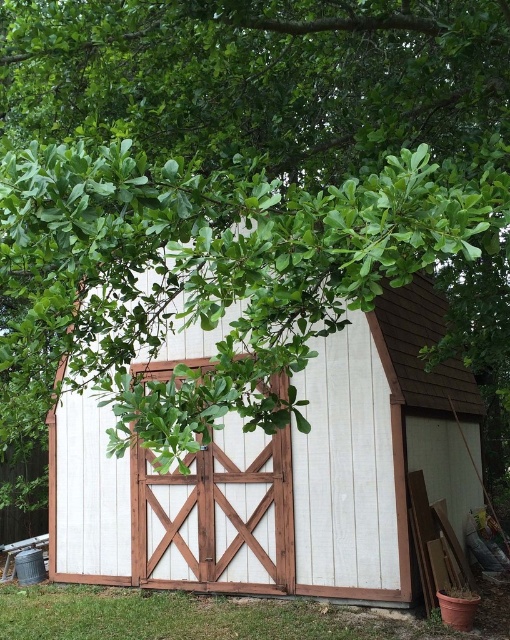
What is the spatial relationship between the white wood barn at center and the white wood barn door at center?

The white wood barn at center is to the right of the white wood barn door at center.

You are standing in front of the shed and want to locate two specific points marked on the shed. The first point is at coordinates point (x=375, y=596) and the second is at point (x=169, y=540). Which point is nearer to you?

Point (x=375, y=596) is closer to the viewer than point (x=169, y=540).